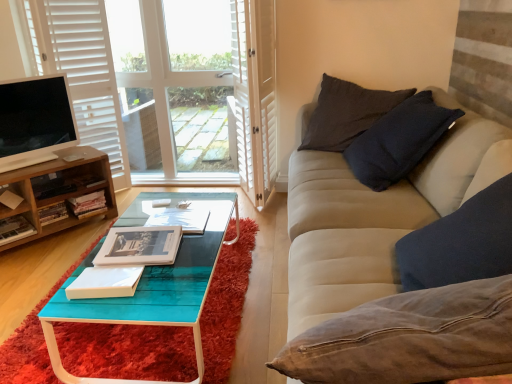
This screenshot has width=512, height=384. I want to click on free space below white glossy television at left (from a real-world perspective), so click(x=35, y=157).